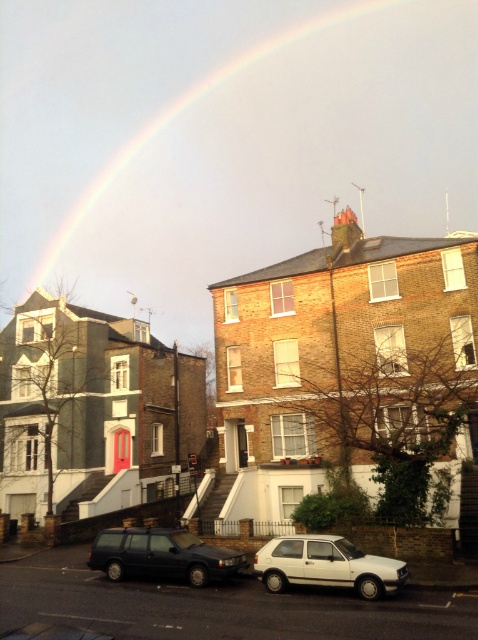
Who is positioned more to the left, rainbow at upper center or white matte hatchback at lower center?

From the viewer's perspective, rainbow at upper center appears more on the left side.

Does rainbow at upper center come in front of white matte hatchback at lower center?

No.

Image resolution: width=478 pixels, height=640 pixels. What do you see at coordinates (223, 138) in the screenshot?
I see `rainbow at upper center` at bounding box center [223, 138].

The height and width of the screenshot is (640, 478). Identify the location of rainbow at upper center. (223, 138).

Is white matte hatchback at lower center above matte black station wagon at center?

Yes.

Does white matte hatchback at lower center lie behind matte black station wagon at center?

No, it is in front of matte black station wagon at center.

Where is `white matte hatchback at lower center`? This screenshot has height=640, width=478. white matte hatchback at lower center is located at coordinates (326, 564).

Is point (150, 236) behind point (220, 564)?

Yes.

Who is taller, rainbow at upper center or matte black station wagon at center?

rainbow at upper center

Does point (456, 68) come in front of point (171, 532)?

No, (456, 68) is further to viewer.

At what (x,y) coordinates should I click in order to perform the action: click on rainbow at upper center. Please return your answer as a coordinate pair (x, y). Looking at the image, I should click on (223, 138).